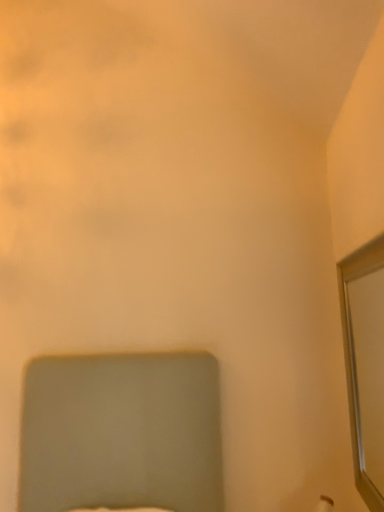
Question: Does white textured mirror at right have a lesser height compared to matte gray bed at lower center?

Choices:
 (A) no
 (B) yes

Answer: (A)

Question: Does white textured mirror at right come behind matte gray bed at lower center?

Choices:
 (A) yes
 (B) no

Answer: (A)

Question: Would you consider white textured mirror at right to be distant from matte gray bed at lower center?

Choices:
 (A) no
 (B) yes

Answer: (A)

Question: Is matte gray bed at lower center at the back of white textured mirror at right?

Choices:
 (A) yes
 (B) no

Answer: (B)

Question: Is white textured mirror at right not within matte gray bed at lower center?

Choices:
 (A) no
 (B) yes

Answer: (B)

Question: Can you confirm if white textured mirror at right is thinner than matte gray bed at lower center?

Choices:
 (A) no
 (B) yes

Answer: (B)

Question: Does matte gray bed at lower center come in front of white textured mirror at right?

Choices:
 (A) yes
 (B) no

Answer: (A)

Question: Can you confirm if matte gray bed at lower center is smaller than white textured mirror at right?

Choices:
 (A) no
 (B) yes

Answer: (A)

Question: Does matte gray bed at lower center come behind white textured mirror at right?

Choices:
 (A) no
 (B) yes

Answer: (A)

Question: Could you tell me if matte gray bed at lower center is facing white textured mirror at right?

Choices:
 (A) yes
 (B) no

Answer: (B)

Question: Is matte gray bed at lower center located outside white textured mirror at right?

Choices:
 (A) yes
 (B) no

Answer: (A)

Question: From a real-world perspective, is matte gray bed at lower center under white textured mirror at right?

Choices:
 (A) yes
 (B) no

Answer: (A)

Question: From their relative heights in the image, would you say white textured mirror at right is taller or shorter than matte gray bed at lower center?

Choices:
 (A) short
 (B) tall

Answer: (B)